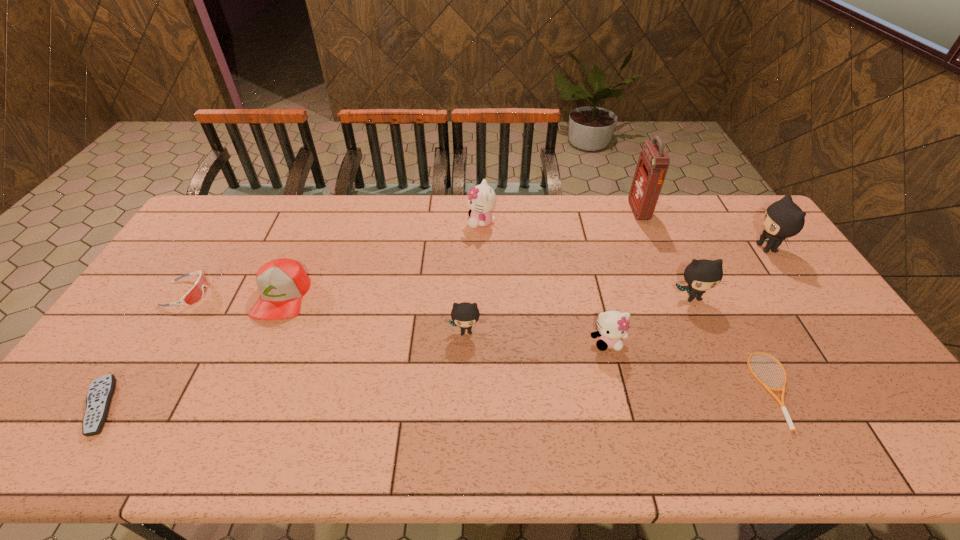
This screenshot has width=960, height=540. I want to click on blank space located on the front-facing side of the leftmost gray kitten, so click(x=465, y=359).

I want to click on free spot located on the front-facing side of the red baseball cap, so click(x=259, y=349).

Where is `vacant space situated 0.100m on the front-facing side of the eighth tallest object`? The image size is (960, 540). vacant space situated 0.100m on the front-facing side of the eighth tallest object is located at coordinates (241, 294).

In order to click on vacant region located on the right of the remote control in this screenshot , I will do `click(272, 406)`.

Locate an element on the screen. This screenshot has width=960, height=540. vacant space located on the right of the tennis racket is located at coordinates (819, 390).

Where is `the first-aid kit present at the far edge`? Image resolution: width=960 pixels, height=540 pixels. the first-aid kit present at the far edge is located at coordinates (653, 163).

Image resolution: width=960 pixels, height=540 pixels. I want to click on remote control at the near edge, so point(101,390).

I want to click on tennis racket that is at the near edge, so click(x=782, y=406).

Locate an element on the screen. The height and width of the screenshot is (540, 960). goggles at the left edge is located at coordinates (196, 292).

Locate an element on the screen. The width and height of the screenshot is (960, 540). remote control present at the left edge is located at coordinates (x=101, y=390).